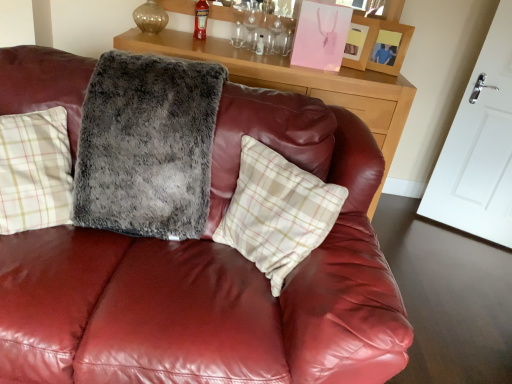
What are the coordinates of `white plaid pillow at center` in the screenshot? It's located at (277, 212).

This screenshot has height=384, width=512. What do you see at coordinates (297, 83) in the screenshot?
I see `wooden cabinet at upper center` at bounding box center [297, 83].

Measure the distance between matte pink picture frame at upper right, which appears as the 1th picture frame when viewed from the left, and camera.

They are 2.37 meters apart.

Identify the location of red glass bottle at upper center. Image resolution: width=512 pixels, height=384 pixels. (201, 19).

The image size is (512, 384). Find the location of `fuzzy gray blanket at center`. fuzzy gray blanket at center is located at coordinates (147, 146).

At what (x,y) coordinates should I click in order to perform the action: click on white plaid pillow at center. Please return your answer as a coordinate pair (x, y). Looking at the image, I should click on (277, 212).

Does point (371, 28) come farther from viewer compared to point (273, 216)?

That is True.

Is the position of matte pink picture frame at upper right, the 2th picture frame in the right-to-left sequence, less distant than that of white plaid pillow at center?

No, matte pink picture frame at upper right, the 2th picture frame in the right-to-left sequence, is further to the viewer.

Can white plaid pillow at center be found inside matte pink picture frame at upper right, which appears as the 1th picture frame when viewed from the left?

No.

Where is `blanket below the red glass bottle at upper center (from a real-world perspective)`? blanket below the red glass bottle at upper center (from a real-world perspective) is located at coordinates (147, 146).

From a real-world perspective, is red glass bottle at upper center on top of fuzzy gray blanket at center?

Yes, from a real-world perspective, red glass bottle at upper center is over fuzzy gray blanket at center

Considering the positions of objects red glass bottle at upper center and fuzzy gray blanket at center in the image provided, who is behind, red glass bottle at upper center or fuzzy gray blanket at center?

red glass bottle at upper center.

Does red glass bottle at upper center have a greater width compared to fuzzy gray blanket at center?

Incorrect, the width of red glass bottle at upper center does not surpass that of fuzzy gray blanket at center.

Is the position of wooden picture frame at upper right, the second picture frame in the left-to-right sequence, more distant than that of wooden cabinet at upper center?

Yes, wooden picture frame at upper right, the second picture frame in the left-to-right sequence, is further from the camera.

Is wooden picture frame at upper right, the second picture frame in the left-to-right sequence, completely or partially outside of wooden cabinet at upper center?

wooden picture frame at upper right, the second picture frame in the left-to-right sequence, is positioned outside wooden cabinet at upper center.

Considering the relative sizes of wooden picture frame at upper right, which is the first picture frame in right-to-left order, and wooden cabinet at upper center in the image provided, is wooden picture frame at upper right, which is the first picture frame in right-to-left order, thinner than wooden cabinet at upper center?

Correct, the width of wooden picture frame at upper right, which is the first picture frame in right-to-left order, is less than that of wooden cabinet at upper center.

How many degrees apart are the facing directions of wooden picture frame at upper right, the second picture frame in the left-to-right sequence, and wooden cabinet at upper center?

The facing directions of wooden picture frame at upper right, the second picture frame in the left-to-right sequence, and wooden cabinet at upper center are 24.5 degrees apart.

Can you tell me how much matte pink picture frame at upper right, the 2th picture frame in the right-to-left sequence, and fuzzy gray blanket at center differ in facing direction?

matte pink picture frame at upper right, the 2th picture frame in the right-to-left sequence, and fuzzy gray blanket at center are facing 25.5 degrees away from each other.

Is point (372, 22) less distant than point (193, 139)?

No, it is behind (193, 139).

Is matte pink picture frame at upper right, the 2th picture frame in the right-to-left sequence, outside of fuzzy gray blanket at center?

Absolutely, matte pink picture frame at upper right, the 2th picture frame in the right-to-left sequence, is external to fuzzy gray blanket at center.

Considering the points (280, 78) and (271, 250), which point is in front, point (280, 78) or point (271, 250)?

Point (271, 250)

Is wooden cabinet at upper center at the right side of white plaid pillow at center?

No, wooden cabinet at upper center is not to the right of white plaid pillow at center.

From a real-world perspective, is wooden cabinet at upper center on white plaid pillow at center?

No.

Measure the distance from wooden cabinet at upper center to white plaid pillow at center.

wooden cabinet at upper center and white plaid pillow at center are 1.07 meters apart from each other.

Considering the points (385, 52) and (369, 54), which point is behind, point (385, 52) or point (369, 54)?

Point (369, 54)

How many degrees apart are the facing directions of wooden picture frame at upper right, the second picture frame in the left-to-right sequence, and matte pink picture frame at upper right, which appears as the 1th picture frame when viewed from the left?

The angular difference between wooden picture frame at upper right, the second picture frame in the left-to-right sequence, and matte pink picture frame at upper right, which appears as the 1th picture frame when viewed from the left, is 1.99 degrees.

Is wooden picture frame at upper right, which is the first picture frame in right-to-left order, in front of or behind matte pink picture frame at upper right, the 2th picture frame in the right-to-left sequence, in the image?

wooden picture frame at upper right, which is the first picture frame in right-to-left order, is positioned farther from the viewer than matte pink picture frame at upper right, the 2th picture frame in the right-to-left sequence.

From a real-world perspective, which object rests below the other?

wooden picture frame at upper right, the second picture frame in the left-to-right sequence, is physically lower.

Does point (319, 228) lie behind point (197, 11)?

No, it is not.

Considering the relative positions of white plaid pillow at center and red glass bottle at upper center in the image provided, is white plaid pillow at center to the left or to the right of red glass bottle at upper center?

white plaid pillow at center is to the right of red glass bottle at upper center.

Considering the relative sizes of white plaid pillow at center and red glass bottle at upper center in the image provided, is white plaid pillow at center taller than red glass bottle at upper center?

Yes.

Which picture frame is the 1st one when counting from the back of the white plaid pillow at center? Please provide its 2D coordinates.

[(360, 42)]

Locate an element on the screen. The image size is (512, 384). alcohol above the fuzzy gray blanket at center (from a real-world perspective) is located at coordinates (201, 19).

Looking at the image, which one is located closer to wooden picture frame at upper right, which is the first picture frame in right-to-left order, white plaid pillow at center or matte pink picture frame at upper right, the 2th picture frame in the right-to-left sequence?

matte pink picture frame at upper right, the 2th picture frame in the right-to-left sequence.

Looking at the image, which one is located further to fuzzy gray blanket at center, matte pink picture frame at upper right, which appears as the 1th picture frame when viewed from the left, or red glass bottle at upper center?

Based on the image, matte pink picture frame at upper right, which appears as the 1th picture frame when viewed from the left, appears to be further to fuzzy gray blanket at center.

Which object lies further to the anchor point red glass bottle at upper center, wooden cabinet at upper center or white plaid pillow at center?

Based on the image, white plaid pillow at center appears to be further to red glass bottle at upper center.

Looking at the image, which one is located closer to wooden picture frame at upper right, the second picture frame in the left-to-right sequence, fuzzy gray blanket at center or red glass bottle at upper center?

red glass bottle at upper center is closer to wooden picture frame at upper right, the second picture frame in the left-to-right sequence.

From the image, which object appears to be nearer to matte pink picture frame at upper right, the 2th picture frame in the right-to-left sequence, red glass bottle at upper center or wooden cabinet at upper center?

Among the two, wooden cabinet at upper center is located nearer to matte pink picture frame at upper right, the 2th picture frame in the right-to-left sequence.

Based on their spatial positions, is red glass bottle at upper center or wooden cabinet at upper center closer to white plaid pillow at center?

wooden cabinet at upper center lies closer to white plaid pillow at center than the other object.

Looking at this image, looking at the image, which one is located closer to white plaid pillow at center, red glass bottle at upper center or fuzzy gray blanket at center?

Among the two, fuzzy gray blanket at center is located nearer to white plaid pillow at center.

Based on their spatial positions, is wooden cabinet at upper center or fuzzy gray blanket at center further from wooden picture frame at upper right, the second picture frame in the left-to-right sequence?

Among the two, fuzzy gray blanket at center is located further to wooden picture frame at upper right, the second picture frame in the left-to-right sequence.

In order to click on blanket between white plaid pillow at center and red glass bottle at upper center from front to back in this screenshot , I will do `click(147, 146)`.

I want to click on table between white plaid pillow at center and matte pink picture frame at upper right, the 2th picture frame in the right-to-left sequence, along the z-axis, so click(297, 83).

The width and height of the screenshot is (512, 384). In order to click on table between fuzzy gray blanket at center and red glass bottle at upper center along the z-axis in this screenshot , I will do `click(297, 83)`.

The image size is (512, 384). Identify the location of table positioned between fuzzy gray blanket at center and matte pink picture frame at upper right, which appears as the 1th picture frame when viewed from the left, from near to far. (297, 83).